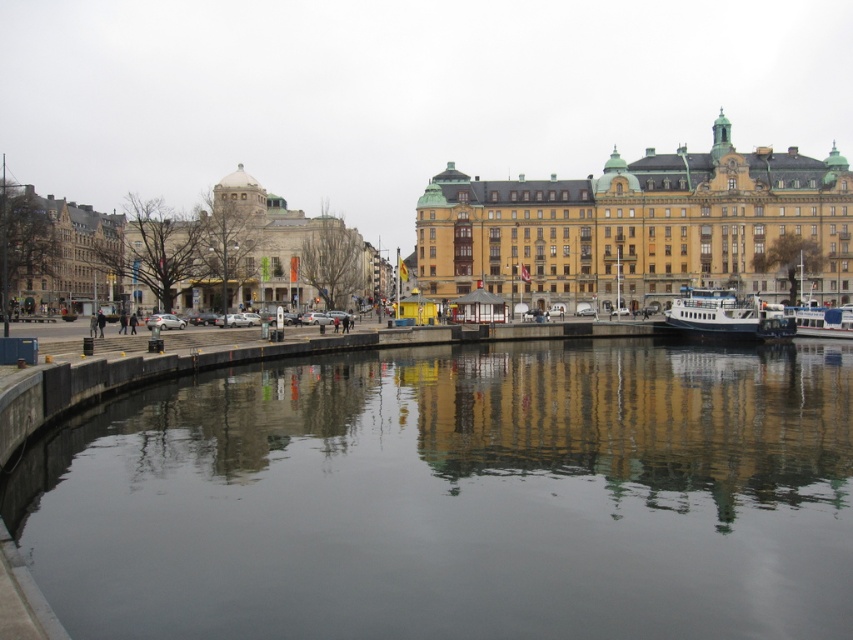
Question: Which object appears farthest from the camera in this image?

Choices:
 (A) yellow stone building at center
 (B) white glossy boat at right

Answer: (A)

Question: Which point is farther to the camera?

Choices:
 (A) (575, 182)
 (B) (154, 236)
 (C) (529, 486)
 (D) (735, 324)

Answer: (B)

Question: Is yellow stone building at center below brown stone building at left?

Choices:
 (A) no
 (B) yes

Answer: (A)

Question: Can you confirm if yellow stone building at center is positioned to the left of brown stone building at left?

Choices:
 (A) no
 (B) yes

Answer: (A)

Question: Is beige stone building at left smaller than brown stone building at left?

Choices:
 (A) yes
 (B) no

Answer: (B)

Question: Which point appears farthest from the camera in this image?

Choices:
 (A) pyautogui.click(x=763, y=272)
 (B) pyautogui.click(x=718, y=333)
 (C) pyautogui.click(x=38, y=308)
 (D) pyautogui.click(x=469, y=570)

Answer: (C)